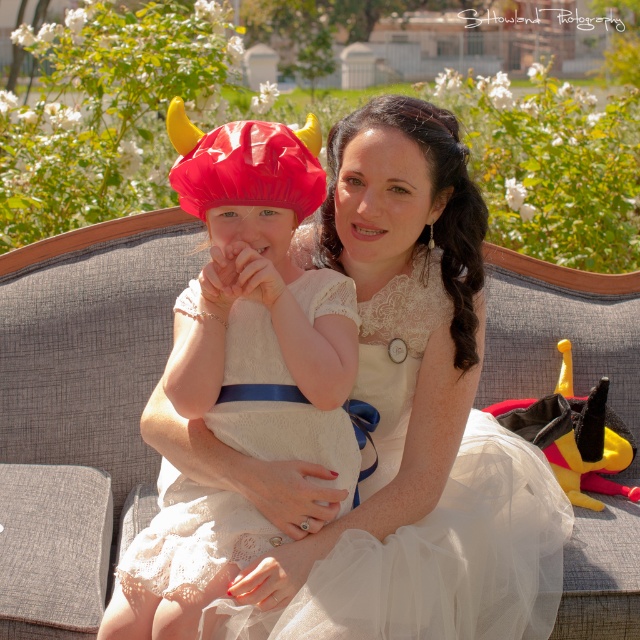
Is lace fabric dress at center to the left of matte white dress at center from the viewer's perspective?

In fact, lace fabric dress at center is to the right of matte white dress at center.

Who is taller, lace fabric dress at center or matte white dress at center?

matte white dress at center is taller.

The image size is (640, 640). Find the location of `lace fabric dress at center`. lace fabric dress at center is located at coordinates (442, 557).

In order to click on lace fabric dress at center in this screenshot , I will do point(442,557).